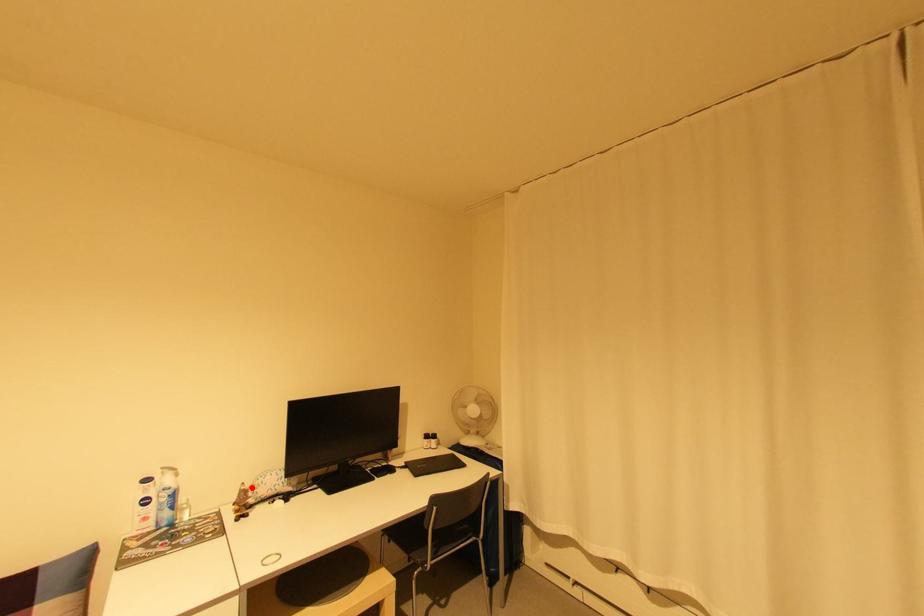
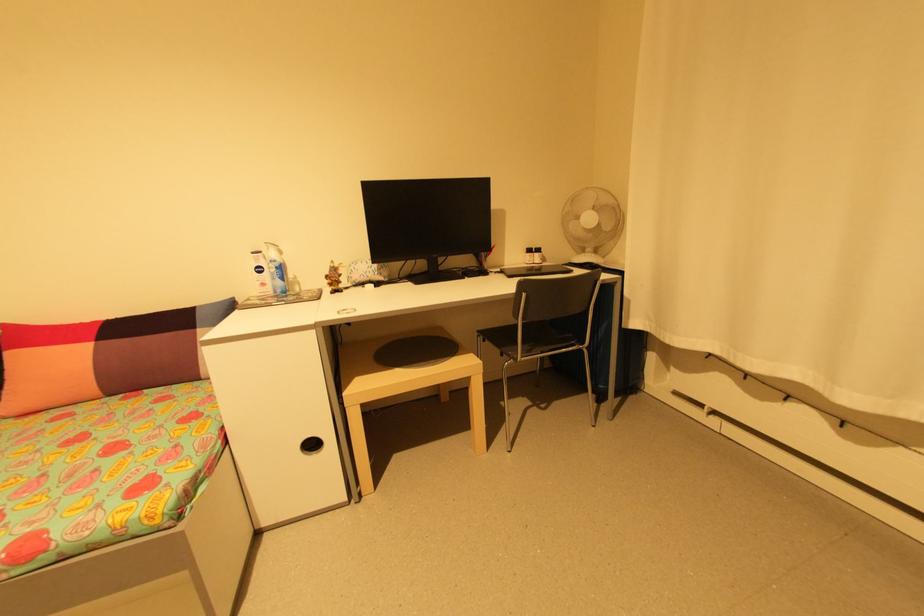
The point at the highlighted location is marked in the first image. Where is the corresponding point in the second image?

(341, 265)